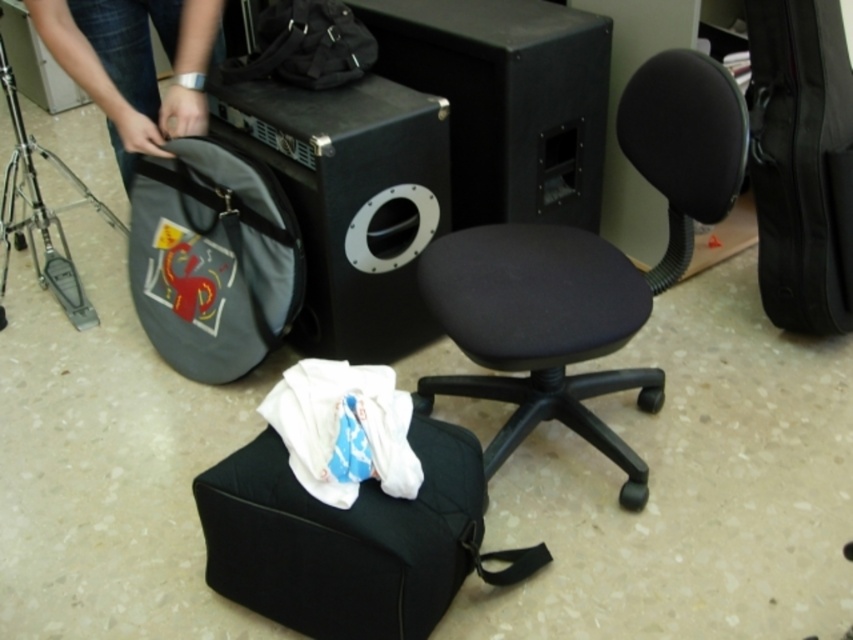
Can you confirm if black matte speaker at upper center is taller than matte black bag at lower left?

Yes, black matte speaker at upper center is taller than matte black bag at lower left.

Is the position of black matte speaker at upper center less distant than that of matte black bag at lower left?

No, it is behind matte black bag at lower left.

Is point (264, 99) positioned before point (204, 61)?

No, it is behind (204, 61).

The width and height of the screenshot is (853, 640). I want to click on black matte speaker at upper center, so click(x=351, y=202).

Who is more forward, (74, 36) or (9, 172)?

Positioned in front is point (74, 36).

From the picture: Can you confirm if matte black bag at lower left is positioned above silver metallic tripod at left?

Yes, matte black bag at lower left is above silver metallic tripod at left.

Who is more distant from viewer, (112, 86) or (51, 278)?

Point (51, 278)

Where is `matte black bag at lower left`? This screenshot has height=640, width=853. matte black bag at lower left is located at coordinates (132, 64).

Which is more to the right, matte black backpack at upper center or silver metallic tripod at left?

Positioned to the right is matte black backpack at upper center.

The image size is (853, 640). What do you see at coordinates (306, 45) in the screenshot?
I see `matte black backpack at upper center` at bounding box center [306, 45].

Does point (305, 24) come closer to viewer compared to point (16, 188)?

That is True.

Where is `matte black backpack at upper center`? Image resolution: width=853 pixels, height=640 pixels. matte black backpack at upper center is located at coordinates (306, 45).